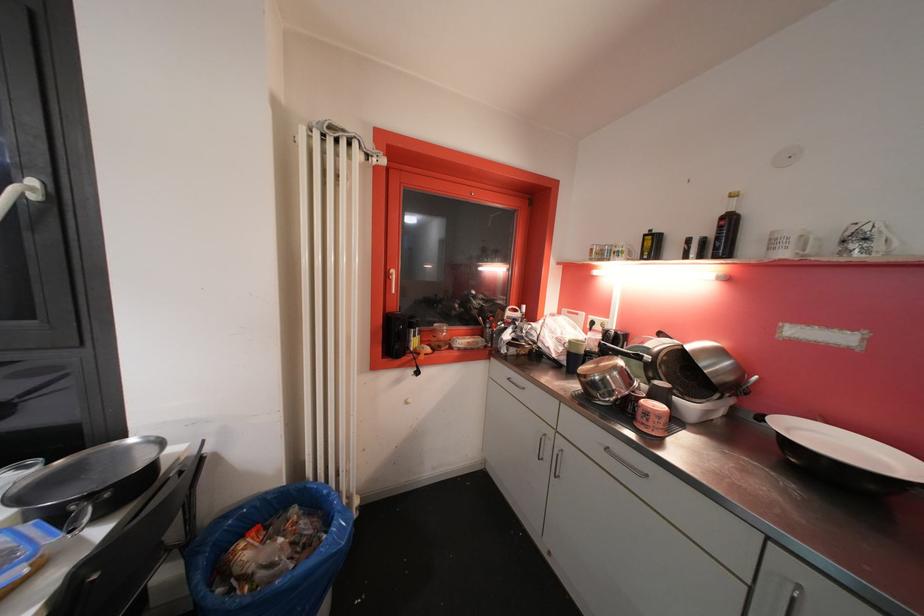
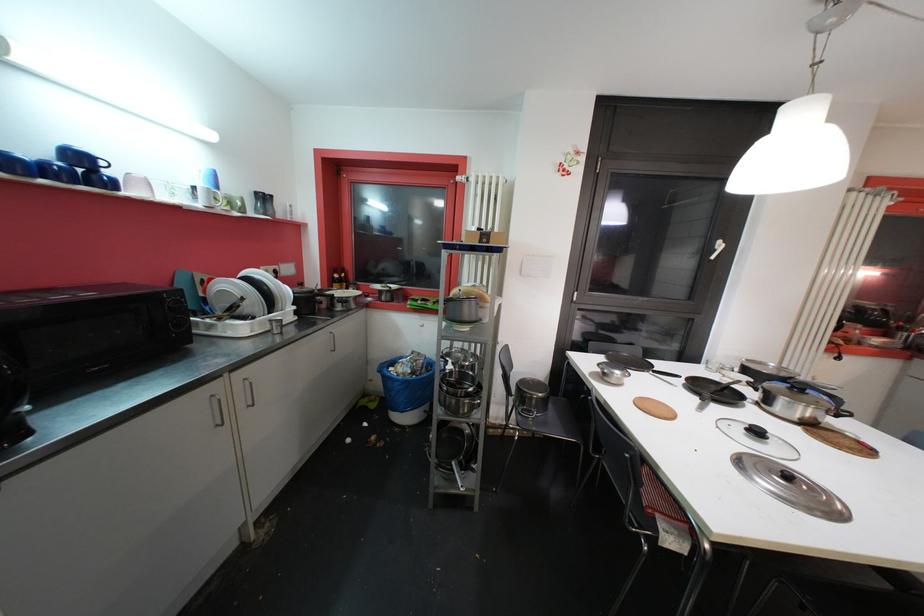
In a continuous first-person perspective shot, in which direction is the camera moving?

The cameraman walked toward left, backward.